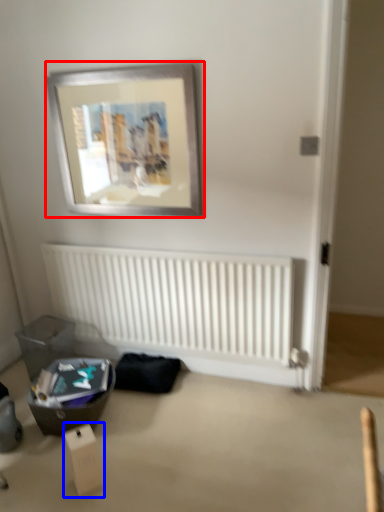
Question: Which object is closer to the camera taking this photo, picture frame (highlighted by a red box) or cardboard box (highlighted by a blue box)?

Choices:
 (A) picture frame
 (B) cardboard box

Answer: (B)